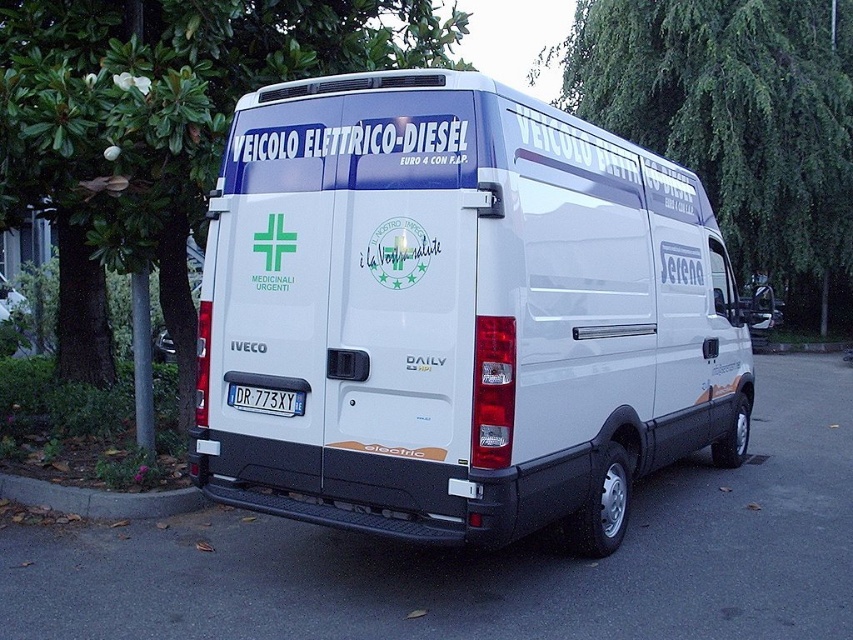
Question: Is white glossy van at center thinner than concrete at lower left?

Choices:
 (A) yes
 (B) no

Answer: (B)

Question: Which of these objects is positioned closest to the concrete at lower left?

Choices:
 (A) white glossy van at center
 (B) black plastic license plate at rear

Answer: (B)

Question: Which object is the closest to the concrete at lower left?

Choices:
 (A) white glossy van at center
 (B) black plastic license plate at rear

Answer: (B)

Question: Which point is closer to the camera?

Choices:
 (A) (149, 493)
 (B) (297, 406)

Answer: (B)

Question: Does white glossy van at center appear under black plastic license plate at rear?

Choices:
 (A) yes
 (B) no

Answer: (B)

Question: In this image, where is white glossy van at center located relative to black plastic license plate at rear?

Choices:
 (A) above
 (B) below

Answer: (A)